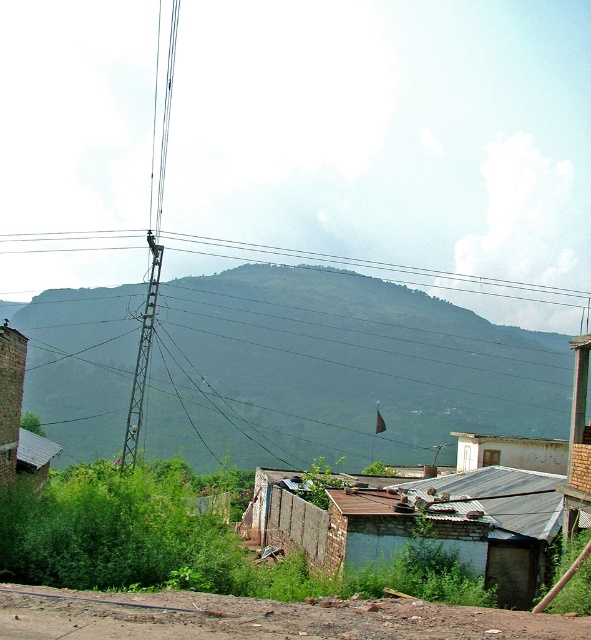
Describe the element at coordinates (349, 365) in the screenshot. Image resolution: width=591 pixels, height=640 pixels. I see `green grassy hill at center` at that location.

Who is lower down, green grassy hill at center or metallic tower at center-left?

green grassy hill at center

Is point (89, 355) closer to camera compared to point (137, 410)?

No.

This screenshot has height=640, width=591. What are the coordinates of `green grassy hill at center` in the screenshot? It's located at (349, 365).

Which of these two, rusty corrugated metal hut at lower right or metallic tower at center-left, stands taller?

With more height is metallic tower at center-left.

Is rusty corrugated metal hut at lower right to the right of metallic tower at center-left from the viewer's perspective?

Indeed, rusty corrugated metal hut at lower right is positioned on the right side of metallic tower at center-left.

Does point (540, 568) come in front of point (151, 260)?

Yes, point (540, 568) is closer to viewer.

The image size is (591, 640). Identify the location of rusty corrugated metal hut at lower right. (421, 524).

Can you confirm if rusty corrugated metal hut at lower right is thinner than metallic wire at upper center?

Yes, rusty corrugated metal hut at lower right is thinner than metallic wire at upper center.

Measure the distance from rusty corrugated metal hut at lower right to metallic wire at upper center.

A distance of 160.30 meters exists between rusty corrugated metal hut at lower right and metallic wire at upper center.

Is point (478, 547) positioned before point (102, 248)?

That is True.

This screenshot has width=591, height=640. I want to click on rusty corrugated metal hut at lower right, so (421, 524).